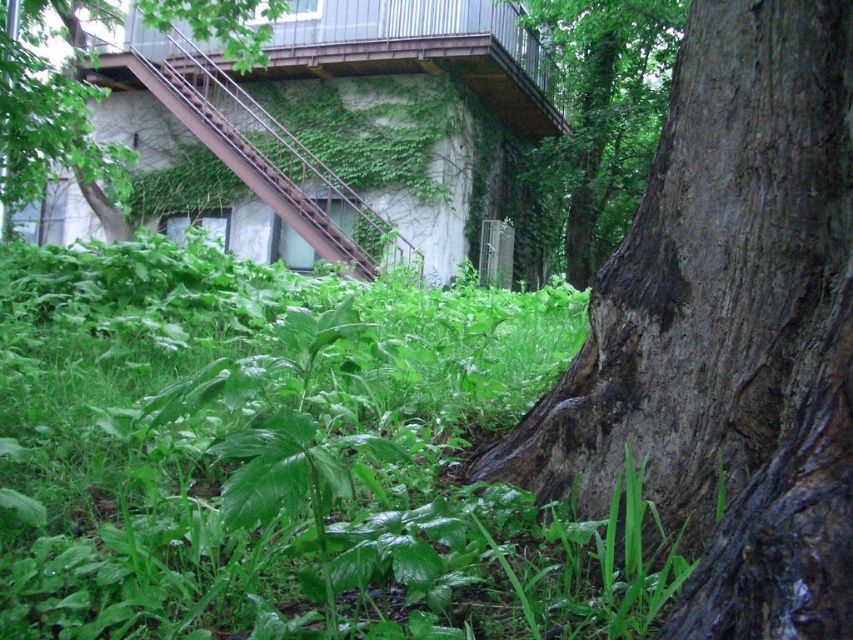
Question: Which point is farther from the camera taking this photo?

Choices:
 (A) (264, 60)
 (B) (634, 36)

Answer: (B)

Question: Is brown rough bark tree at right bigger than dark brown bark tree at center?

Choices:
 (A) no
 (B) yes

Answer: (A)

Question: Can you confirm if green leafy tree at upper left is bigger than brown metal staircase at upper center?

Choices:
 (A) no
 (B) yes

Answer: (B)

Question: Estimate the real-world distances between objects in this image. Which object is farther from the green leafy grass at center?

Choices:
 (A) dark brown bark tree at center
 (B) brown rough bark tree at right
 (C) green leafy tree at upper left

Answer: (A)

Question: Does dark brown bark tree at center appear under brown metal staircase at upper center?

Choices:
 (A) no
 (B) yes

Answer: (A)

Question: Which object is closer to the camera taking this photo?

Choices:
 (A) brown rough bark tree at right
 (B) green leafy grass at center

Answer: (A)